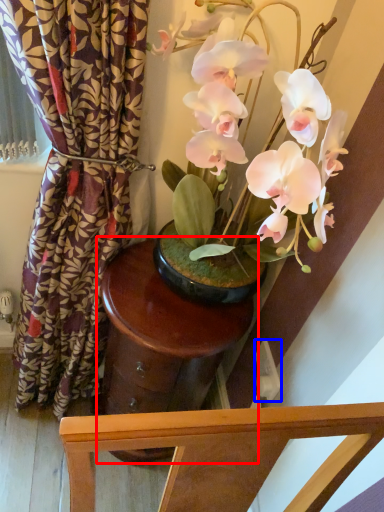
Question: Among these objects, which one is farthest to the camera, round table (highlighted by a red box) or power outlet (highlighted by a blue box)?

Choices:
 (A) round table
 (B) power outlet

Answer: (B)